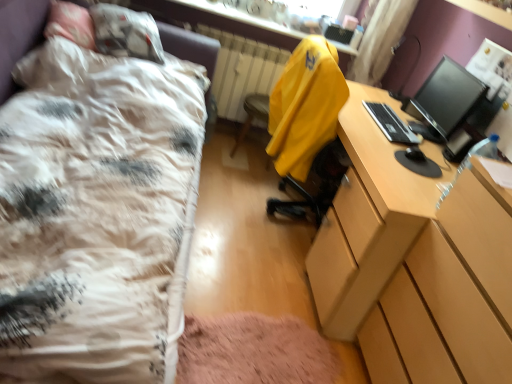
Question: Is yellow fabric computer chair at center positioned before yellow fabric jacket at center?

Choices:
 (A) no
 (B) yes

Answer: (A)

Question: Considering the relative sizes of yellow fabric computer chair at center and yellow fabric jacket at center in the image provided, is yellow fabric computer chair at center wider than yellow fabric jacket at center?

Choices:
 (A) no
 (B) yes

Answer: (A)

Question: Is yellow fabric computer chair at center thinner than yellow fabric jacket at center?

Choices:
 (A) no
 (B) yes

Answer: (B)

Question: From the image's perspective, is yellow fabric computer chair at center below yellow fabric jacket at center?

Choices:
 (A) no
 (B) yes

Answer: (B)

Question: From a real-world perspective, does yellow fabric computer chair at center stand above yellow fabric jacket at center?

Choices:
 (A) yes
 (B) no

Answer: (B)

Question: Looking at the image, does black plastic keyboard at right seem bigger or smaller compared to yellow fabric computer chair at center?

Choices:
 (A) big
 (B) small

Answer: (B)

Question: Is black plastic keyboard at right taller or shorter than yellow fabric computer chair at center?

Choices:
 (A) tall
 (B) short

Answer: (B)

Question: Would you say black plastic keyboard at right is inside or outside yellow fabric computer chair at center?

Choices:
 (A) outside
 (B) inside

Answer: (A)

Question: Looking at their shapes, would you say black plastic keyboard at right is wider or thinner than yellow fabric computer chair at center?

Choices:
 (A) thin
 (B) wide

Answer: (A)

Question: Does point (366, 46) appear closer or farther from the camera than point (470, 92)?

Choices:
 (A) closer
 (B) farther

Answer: (B)

Question: From a real-world perspective, is curtain at upper right physically located above or below black glossy monitor at upper right?

Choices:
 (A) below
 (B) above

Answer: (B)

Question: Is curtain at upper right bigger or smaller than black glossy monitor at upper right?

Choices:
 (A) small
 (B) big

Answer: (B)

Question: Is curtain at upper right wider or thinner than black glossy monitor at upper right?

Choices:
 (A) wide
 (B) thin

Answer: (A)

Question: Is black plastic keyboard at right situated inside yellow fabric jacket at center or outside?

Choices:
 (A) inside
 (B) outside

Answer: (B)

Question: Visually, is black plastic keyboard at right positioned to the left or to the right of yellow fabric jacket at center?

Choices:
 (A) left
 (B) right

Answer: (B)